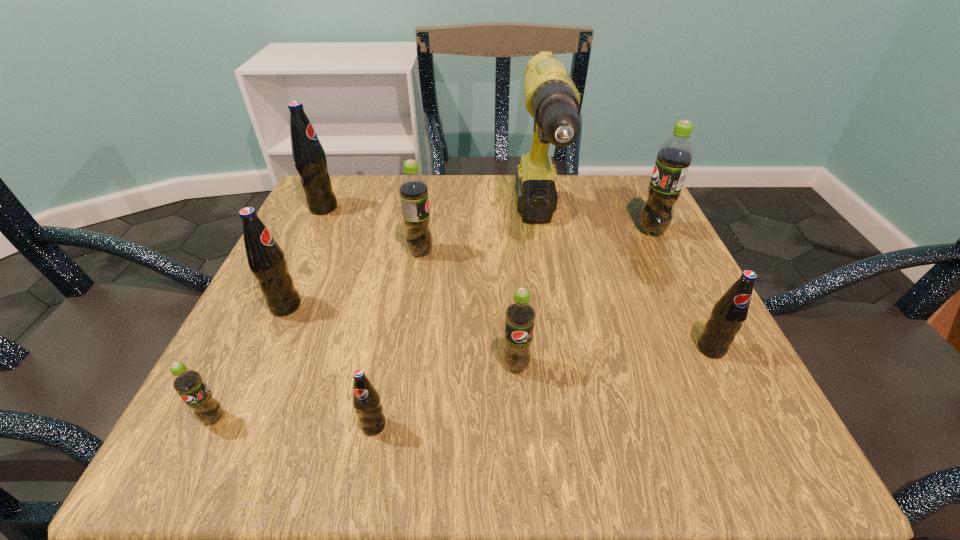
I want to click on free space located 0.100m on the front label of the rightmost green soda, so click(x=588, y=231).

Where is `free space located 0.230m on the front label of the rightmost green soda`? Image resolution: width=960 pixels, height=540 pixels. free space located 0.230m on the front label of the rightmost green soda is located at coordinates (526, 231).

You are a GUI agent. You are given a task and a screenshot of the screen. Output one action in this format:
    pyautogui.click(x=<x>, y=<y>)
    Task: Click on the free point located 0.110m on the front label of the fifth farthest object
    
    Given the screenshot: What is the action you would take?
    pyautogui.click(x=366, y=306)

Identify the location of free space located on the front label of the third farthest soda. (627, 252).

Find the location of a particular element. The image size is (960, 540). free space located on the front label of the sixth soda from left to right is located at coordinates (519, 414).

The height and width of the screenshot is (540, 960). Find the location of `drill that is positioned at the far edge`. drill that is positioned at the far edge is located at coordinates (551, 97).

You are a GUI agent. You are given a task and a screenshot of the screen. Output one action in this format:
    pyautogui.click(x=<x>, y=<y>)
    Task: Click on the object located at the far left corner
    
    Given the screenshot: What is the action you would take?
    pyautogui.click(x=309, y=158)

Identify the location of object at the near left corner. This screenshot has width=960, height=540. (188, 383).

I want to click on object that is positioned at the far right corner, so click(x=674, y=157).

I want to click on blank space at the far edge of the desktop, so click(x=460, y=174).